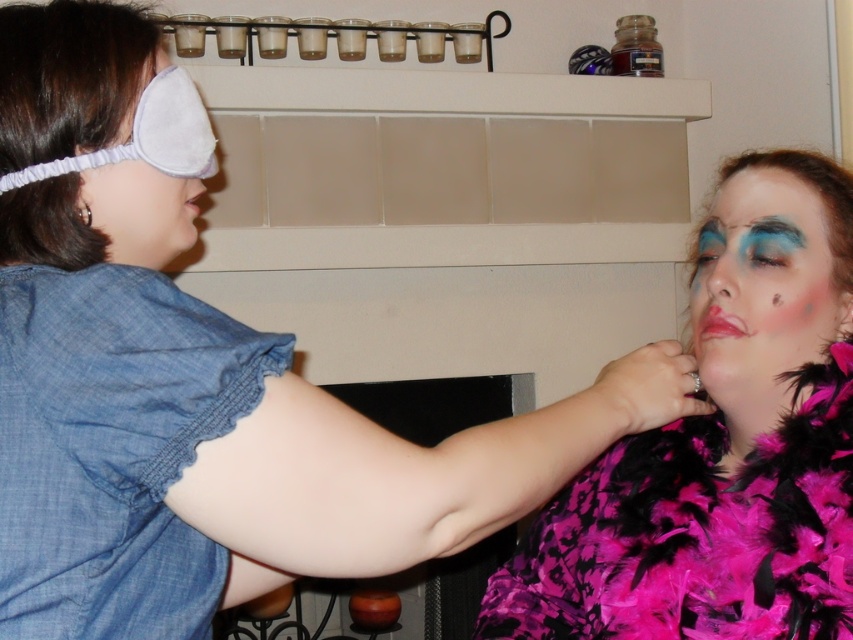
You are a photographer setting up for a photoshoot and need to position a light source between the denim fabric dress at left and the gray fabric eye mask at left. Based on the scene description, which object should the light be placed closer to in order to ensure proper illumination?

The denim fabric dress at left is closer to the viewer than the gray fabric eye mask at left, so the light source should be placed closer to the denim fabric dress at left to ensure proper illumination.

Looking at this image, you are a fashion designer observing the two items, the denim fabric dress at left and the gray fabric eye mask at left. Which item has a greater height?

The denim fabric dress at left is taller than the gray fabric eye mask at left according to the description.

You are a photographer standing at the camera position. You want to focus on the point at point (x=137, y=557). The camera has a depth of field that can cover objects within 25 inches. Will the point be in focus?

The point at point (x=137, y=557) is 28.90 inches away from the camera, which is beyond the depth of field range of 25 inches. Therefore, the point will not be in focus.